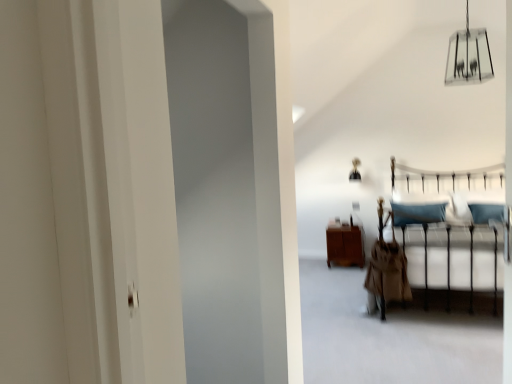
Question: Based on their positions, is brown wood cabinet at center located to the left or right of clear glass chandelier at upper center, the first lamp viewed from the front?

Choices:
 (A) right
 (B) left

Answer: (B)

Question: From the image's perspective, is brown wood cabinet at center located above or below clear glass chandelier at upper center, the 2th lamp viewed from the back?

Choices:
 (A) above
 (B) below

Answer: (B)

Question: Estimate the real-world distances between objects in this image. Which object is farther from the brown wood cabinet at center?

Choices:
 (A) metallic gold lamp at upper center, the 2th lamp in the front-to-back sequence
 (B) metallic silver bed frame at center
 (C) clear glass chandelier at upper center, arranged as the second lamp when ordered from the bottom

Answer: (C)

Question: Based on their relative distances, which object is farther from the metallic silver bed frame at center?

Choices:
 (A) metallic gold lamp at upper center, which is the 1th lamp in back-to-front order
 (B) clear glass chandelier at upper center, the 2th lamp viewed from the back
 (C) brown wood cabinet at center

Answer: (A)